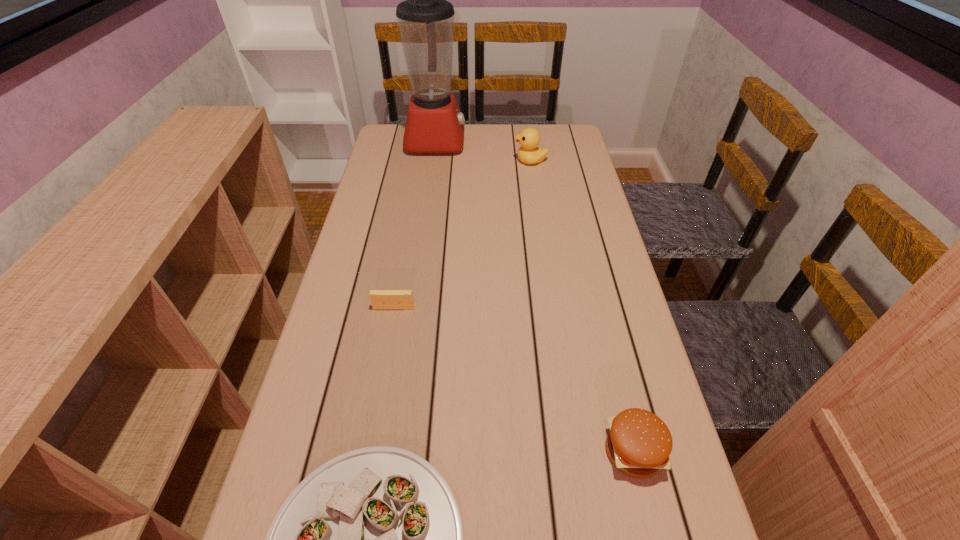
Locate an element on the screen. The width and height of the screenshot is (960, 540). vacant region at the far edge is located at coordinates (481, 125).

Identify the location of vacant space at the left edge. (354, 267).

Where is `vacant region at the right edge of the desktop`? The height and width of the screenshot is (540, 960). vacant region at the right edge of the desktop is located at coordinates (633, 352).

This screenshot has width=960, height=540. What are the coordinates of `free space between the blender and the fourth object from left to right` in the screenshot? It's located at (483, 151).

I want to click on free point between the third nearest object and the third shortest object, so [x=514, y=380].

The width and height of the screenshot is (960, 540). I want to click on vacant point located between the tallest object and the videotape, so click(415, 225).

Locate an element on the screen. The height and width of the screenshot is (540, 960). empty location between the fourth shortest object and the blender is located at coordinates (483, 151).

Find the location of a particular element. The image size is (960, 540). free spot between the duck and the videotape is located at coordinates (462, 234).

Identify which object is the third nearest to the videotape. Please provide its 2D coordinates. Your answer should be formatted as a tuple, i.e. [(x, y)], where the tuple contains the x and y coordinates of a point satisfying the conditions above.

[(434, 124)]

Identify which object is the closest to the third nearest object. Please provide its 2D coordinates. Your answer should be formatted as a tuple, i.e. [(x, y)], where the tuple contains the x and y coordinates of a point satisfying the conditions above.

[(372, 539)]